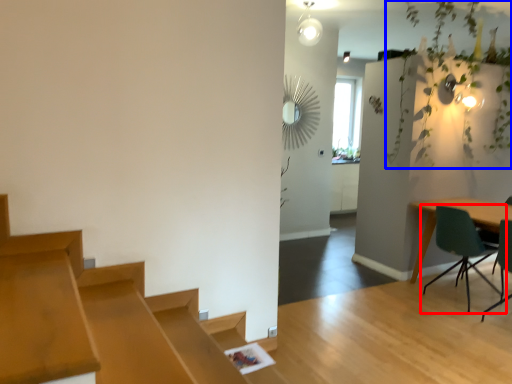
Question: Which object appears closest to the camera in this image, chair (highlighted by a red box) or vegetation (highlighted by a blue box)?

Choices:
 (A) chair
 (B) vegetation

Answer: (A)